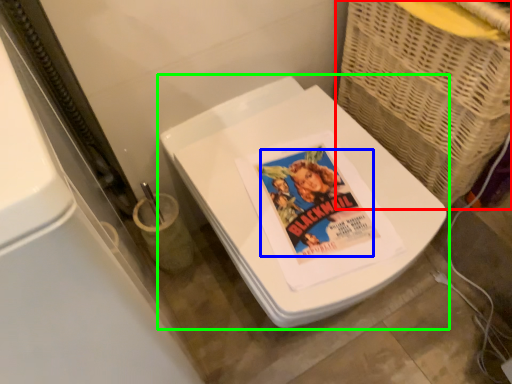
Question: Which object is positioned closest to basket (highlighted by a red box)? Select from comic book character (highlighted by a blue box) and toilet (highlighted by a green box).

Choices:
 (A) comic book character
 (B) toilet

Answer: (B)